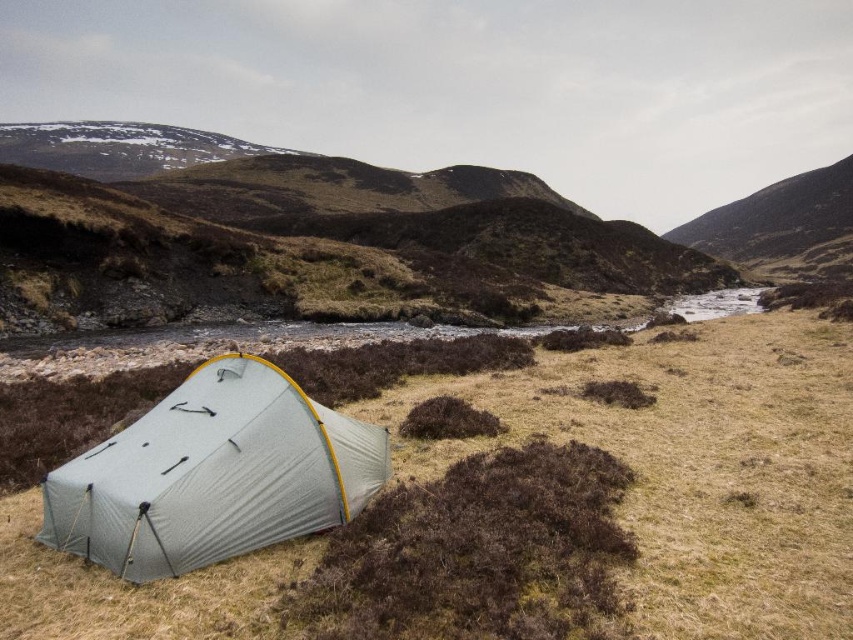
Question: Which object appears closest to the camera in this image?

Choices:
 (A) green fabric tent at lower left
 (B) brown grassy hillside at center

Answer: (A)

Question: Which object is closer to the camera taking this photo?

Choices:
 (A) green fabric tent at lower left
 (B) gray fabric tent at lower left

Answer: (A)

Question: Can you confirm if green fabric tent at lower left is thinner than gray fabric tent at lower left?

Choices:
 (A) yes
 (B) no

Answer: (B)

Question: Among these points, which one is farthest from the camera?

Choices:
 (A) (741, 356)
 (B) (358, 451)
 (C) (299, 157)

Answer: (C)

Question: Is green fabric tent at lower left thinner than brown grassy hillside at center?

Choices:
 (A) yes
 (B) no

Answer: (A)

Question: Does green fabric tent at lower left appear over gray fabric tent at lower left?

Choices:
 (A) yes
 (B) no

Answer: (B)